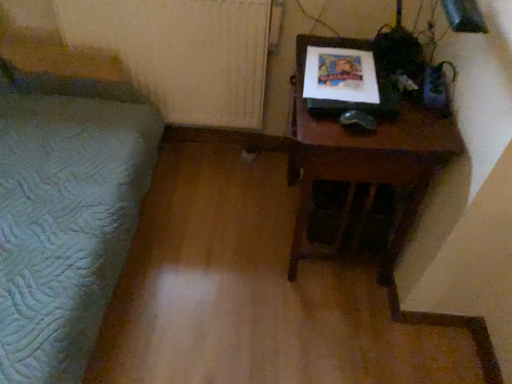
I want to click on vacant region to the right of green quilted bedspread at left, so click(233, 271).